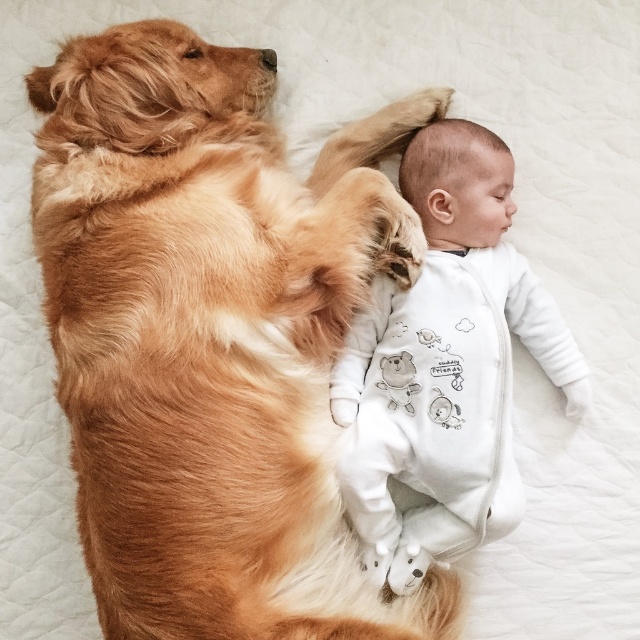
Describe the element at coordinates (211, 336) in the screenshot. I see `golden fur dog at upper left` at that location.

Find the location of a particular element. golden fur dog at upper left is located at coordinates pyautogui.click(x=211, y=336).